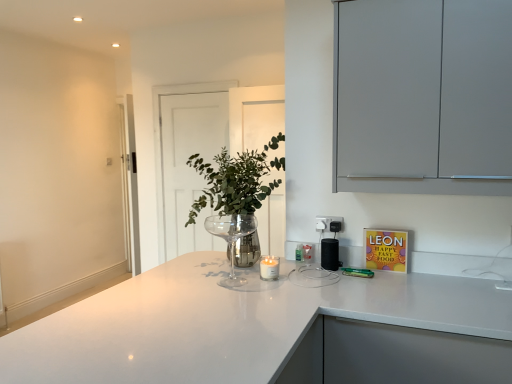
Question: Is clear glass wine glass at center further to camera compared to black plastic speaker at center?

Choices:
 (A) no
 (B) yes

Answer: (A)

Question: Can you confirm if clear glass wine glass at center is taller than black plastic speaker at center?

Choices:
 (A) no
 (B) yes

Answer: (B)

Question: Is clear glass wine glass at center bigger than black plastic speaker at center?

Choices:
 (A) no
 (B) yes

Answer: (B)

Question: Does clear glass wine glass at center appear on the left side of black plastic speaker at center?

Choices:
 (A) no
 (B) yes

Answer: (B)

Question: From the image's perspective, is clear glass wine glass at center below black plastic speaker at center?

Choices:
 (A) yes
 (B) no

Answer: (B)

Question: Does point (323, 263) appear closer or farther from the camera than point (94, 304)?

Choices:
 (A) farther
 (B) closer

Answer: (A)

Question: Considering the positions of black plastic speaker at center and white glossy countertop at center in the image, is black plastic speaker at center bigger or smaller than white glossy countertop at center?

Choices:
 (A) small
 (B) big

Answer: (A)

Question: Considering their positions, is black plastic speaker at center located in front of or behind white glossy countertop at center?

Choices:
 (A) behind
 (B) front

Answer: (A)

Question: Considering the positions of black plastic speaker at center and white glossy countertop at center in the image, is black plastic speaker at center wider or thinner than white glossy countertop at center?

Choices:
 (A) wide
 (B) thin

Answer: (B)

Question: Considering the positions of point (175, 99) and point (244, 193), is point (175, 99) closer or farther from the camera than point (244, 193)?

Choices:
 (A) farther
 (B) closer

Answer: (A)

Question: Is transparent glass door at center in front of or behind green leafy plant at center in the image?

Choices:
 (A) front
 (B) behind

Answer: (B)

Question: Is transparent glass door at center inside or outside of green leafy plant at center?

Choices:
 (A) inside
 (B) outside

Answer: (B)

Question: In terms of width, does transparent glass door at center look wider or thinner when compared to green leafy plant at center?

Choices:
 (A) thin
 (B) wide

Answer: (A)

Question: Visually, is black plastic electric outlet at upper right positioned to the left or to the right of green leafy plant at center?

Choices:
 (A) right
 (B) left

Answer: (A)

Question: Is black plastic electric outlet at upper right inside the boundaries of green leafy plant at center, or outside?

Choices:
 (A) outside
 (B) inside

Answer: (A)